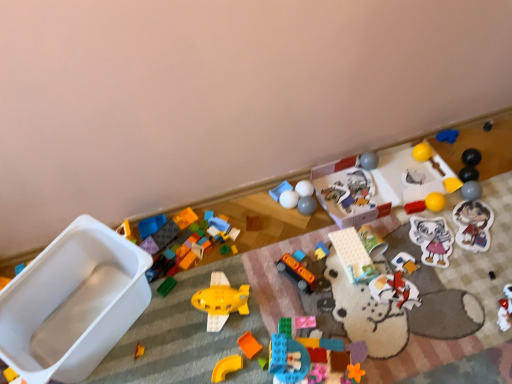
The width and height of the screenshot is (512, 384). What are the coordinates of `empty space that is in between yellow plastic curve at center, which ranks as the 21th toy in right-to-left order, and yellow plastic airplane at center, placed as the fourth toy when sorted from left to right` in the screenshot? It's located at (222, 351).